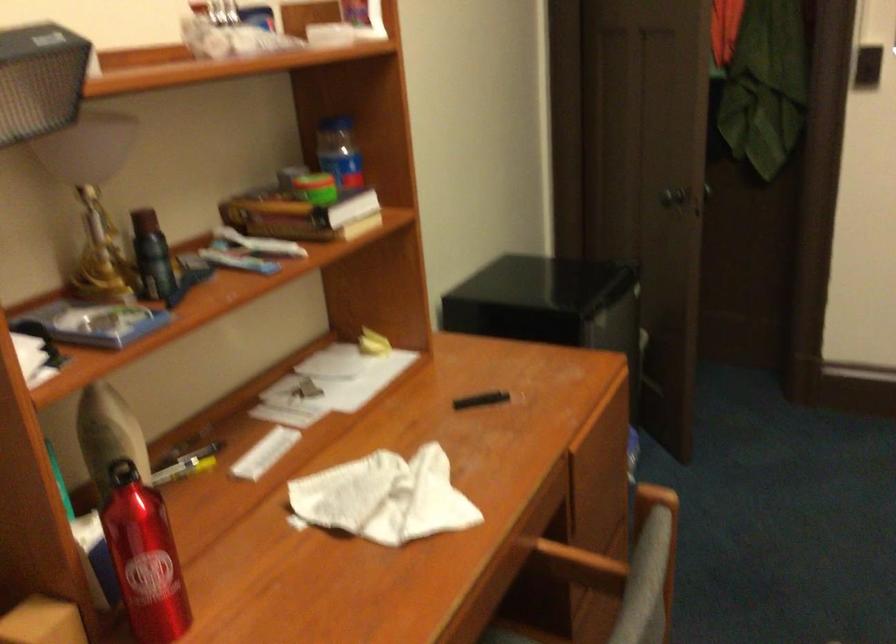
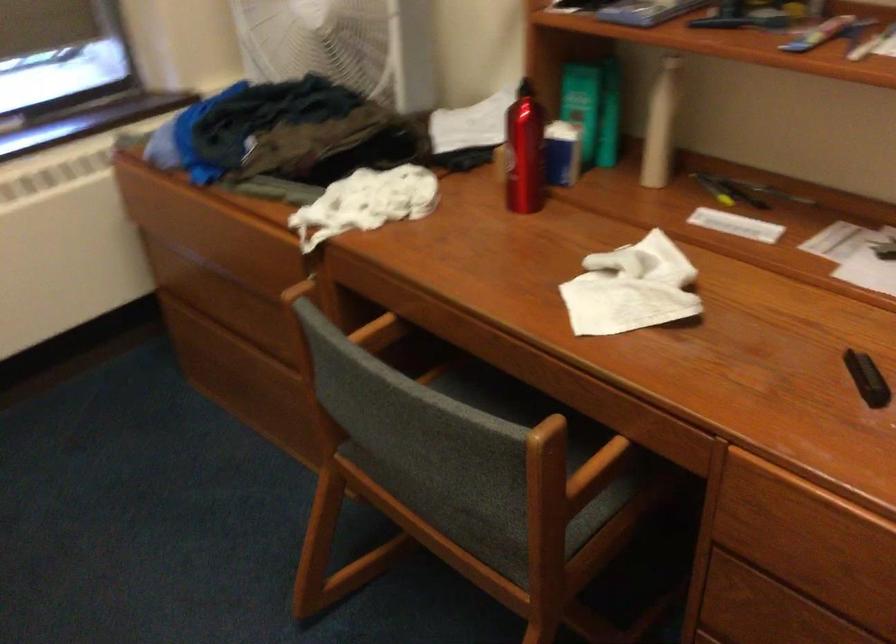
Locate, in the second image, the point that corresponds to [149,440] in the first image.

(659, 125)